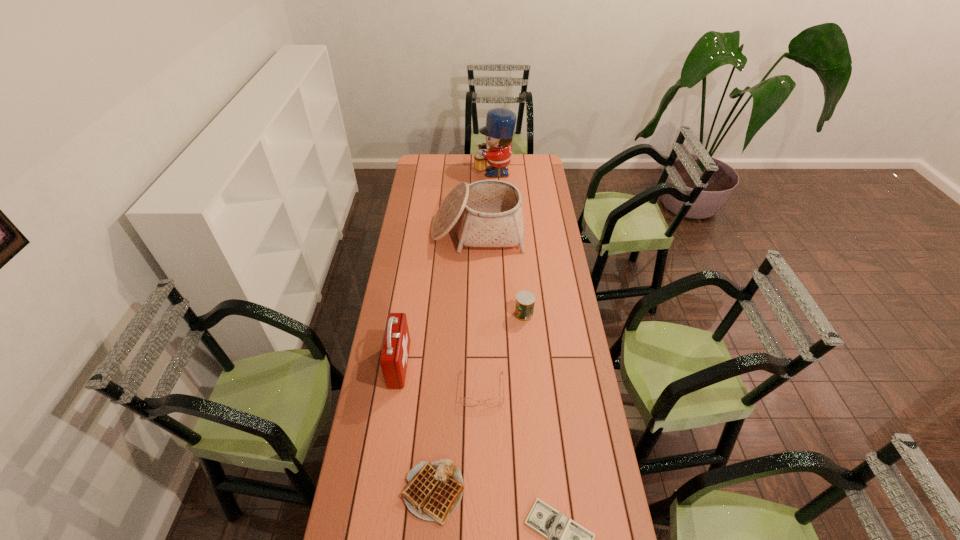
Identify the location of vacant area situated on the front-facing side of the nutcracker. The image size is (960, 540). (416, 171).

Where is `vacant point located 0.220m with the lid open on the basket`? Image resolution: width=960 pixels, height=540 pixels. vacant point located 0.220m with the lid open on the basket is located at coordinates (477, 287).

You are a GUI agent. You are given a task and a screenshot of the screen. Output one action in this format:
    pyautogui.click(x=<x>, y=<y>)
    Task: Click on the vacant space located 0.160m on the front face of the first-aid kit
    
    Given the screenshot: What is the action you would take?
    click(450, 364)

Where is `vacant area situated 0.050m on the right of the fifth nearest object`? Image resolution: width=960 pixels, height=540 pixels. vacant area situated 0.050m on the right of the fifth nearest object is located at coordinates (545, 314).

I want to click on free space located on the front-facing side of the spectacles, so click(483, 519).

The image size is (960, 540). I want to click on free space located on the right of the waffle, so click(x=556, y=491).

Where is `object at the far edge`? Image resolution: width=960 pixels, height=540 pixels. object at the far edge is located at coordinates (500, 123).

Identify the location of basket located at the left edge. (488, 213).

Locate an element on the screen. This screenshot has height=540, width=960. the first-aid kit present at the left edge is located at coordinates (395, 350).

Where is `vacant area at the far edge`? This screenshot has height=540, width=960. vacant area at the far edge is located at coordinates (480, 173).